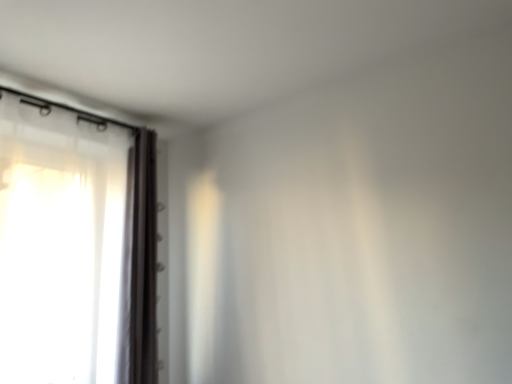
Measure the distance between white sheer curtain at left, the 2th curtain when ordered from right to left, and camera.

The distance of white sheer curtain at left, the 2th curtain when ordered from right to left, from camera is 5.32 feet.

The height and width of the screenshot is (384, 512). What do you see at coordinates (64, 245) in the screenshot?
I see `white sheer curtain at left, the 2th curtain when ordered from right to left` at bounding box center [64, 245].

You are a GUI agent. You are given a task and a screenshot of the screen. Output one action in this format:
    pyautogui.click(x=<x>, y=<y>)
    Task: Click on the white sheer curtain at left, the 2th curtain when ordered from right to left
    Image resolution: width=512 pixels, height=384 pixels.
    Given the screenshot: What is the action you would take?
    coord(64,245)

Measure the distance between point (112, 340) and camera.

The distance of point (112, 340) from camera is 6.18 feet.

How much space does white sheer curtain at left, marked as the second curtain in a left-to-right arrangement, occupy horizontally?

white sheer curtain at left, marked as the second curtain in a left-to-right arrangement, is 14.23 centimeters wide.

Describe the element at coordinates (140, 265) in the screenshot. This screenshot has width=512, height=384. I see `white sheer curtain at left, the first curtain in the right-to-left sequence` at that location.

Locate an element on the screen. This screenshot has height=384, width=512. white sheer curtain at left, marked as the second curtain in a left-to-right arrangement is located at coordinates (140, 265).

Image resolution: width=512 pixels, height=384 pixels. Find the location of `white sheer curtain at left, the 2th curtain when ordered from right to left`. white sheer curtain at left, the 2th curtain when ordered from right to left is located at coordinates (64, 245).

Consider the image. Based on their positions, is white sheer curtain at left, the first curtain viewed from the left, located to the left or right of white sheer curtain at left, the first curtain in the right-to-left sequence?

Clearly, white sheer curtain at left, the first curtain viewed from the left, is on the left of white sheer curtain at left, the first curtain in the right-to-left sequence, in the image.

In the image, is white sheer curtain at left, the 2th curtain when ordered from right to left, positioned in front of or behind white sheer curtain at left, the first curtain in the right-to-left sequence?

white sheer curtain at left, the 2th curtain when ordered from right to left, is positioned closer to the viewer than white sheer curtain at left, the first curtain in the right-to-left sequence.

Is point (19, 305) farther from viewer compared to point (146, 319)?

No, it is not.

From the image's perspective, is white sheer curtain at left, the first curtain viewed from the left, located above or below white sheer curtain at left, marked as the second curtain in a left-to-right arrangement?

Clearly, from the image's perspective, white sheer curtain at left, the first curtain viewed from the left, is above white sheer curtain at left, marked as the second curtain in a left-to-right arrangement.

From a real-world perspective, is white sheer curtain at left, the 2th curtain when ordered from right to left, located higher than white sheer curtain at left, marked as the second curtain in a left-to-right arrangement?

Yes.

Does white sheer curtain at left, the 2th curtain when ordered from right to left, have a greater width compared to white sheer curtain at left, marked as the second curtain in a left-to-right arrangement?

Yes.

Which of these two, white sheer curtain at left, the 2th curtain when ordered from right to left, or white sheer curtain at left, the first curtain in the right-to-left sequence, stands shorter?

white sheer curtain at left, the first curtain in the right-to-left sequence.

Who is smaller, white sheer curtain at left, the 2th curtain when ordered from right to left, or white sheer curtain at left, the first curtain in the right-to-left sequence?

white sheer curtain at left, the first curtain in the right-to-left sequence.

Do you think white sheer curtain at left, the 2th curtain when ordered from right to left, is within white sheer curtain at left, marked as the second curtain in a left-to-right arrangement, or outside of it?

The correct answer is: outside.

Is white sheer curtain at left, the first curtain viewed from the left, positioned far away from white sheer curtain at left, the first curtain in the right-to-left sequence?

They are positioned close to each other.

Is white sheer curtain at left, the 2th curtain when ordered from right to left, facing away from white sheer curtain at left, the first curtain in the right-to-left sequence?

No, white sheer curtain at left, the 2th curtain when ordered from right to left, is not facing the opposite direction of white sheer curtain at left, the first curtain in the right-to-left sequence.

How many degrees apart are the facing directions of white sheer curtain at left, the first curtain viewed from the left, and white sheer curtain at left, marked as the second curtain in a left-to-right arrangement?

There is a 2.17-degree angle between the facing directions of white sheer curtain at left, the first curtain viewed from the left, and white sheer curtain at left, marked as the second curtain in a left-to-right arrangement.

Could you measure the distance between white sheer curtain at left, the first curtain viewed from the left, and white sheer curtain at left, marked as the second curtain in a left-to-right arrangement?

white sheer curtain at left, the first curtain viewed from the left, and white sheer curtain at left, marked as the second curtain in a left-to-right arrangement, are 8.05 inches apart from each other.

This screenshot has width=512, height=384. I want to click on curtain above the white sheer curtain at left, the first curtain in the right-to-left sequence (from the image's perspective), so click(64, 245).

Can you confirm if white sheer curtain at left, marked as the second curtain in a left-to-right arrangement, is positioned to the left of white sheer curtain at left, the 2th curtain when ordered from right to left?

No, white sheer curtain at left, marked as the second curtain in a left-to-right arrangement, is not to the left of white sheer curtain at left, the 2th curtain when ordered from right to left.

Considering the relative positions of white sheer curtain at left, the first curtain in the right-to-left sequence, and white sheer curtain at left, the 2th curtain when ordered from right to left, in the image provided, is white sheer curtain at left, the first curtain in the right-to-left sequence, behind white sheer curtain at left, the 2th curtain when ordered from right to left,?

Yes, it is.

Between point (151, 178) and point (53, 382), which one is positioned in front?

Point (53, 382)

From the image's perspective, is white sheer curtain at left, the first curtain in the right-to-left sequence, above or below white sheer curtain at left, the 2th curtain when ordered from right to left?

white sheer curtain at left, the first curtain in the right-to-left sequence, is below white sheer curtain at left, the 2th curtain when ordered from right to left.

From a real-world perspective, is white sheer curtain at left, marked as the second curtain in a left-to-right arrangement, positioned under white sheer curtain at left, the 2th curtain when ordered from right to left, based on gravity?

Yes, from a real-world perspective, white sheer curtain at left, marked as the second curtain in a left-to-right arrangement, is beneath white sheer curtain at left, the 2th curtain when ordered from right to left.

Can you confirm if white sheer curtain at left, marked as the second curtain in a left-to-right arrangement, is wider than white sheer curtain at left, the first curtain viewed from the left?

No.

Between white sheer curtain at left, the first curtain in the right-to-left sequence, and white sheer curtain at left, the first curtain viewed from the left, which one has more height?

white sheer curtain at left, the first curtain viewed from the left, is taller.

Considering the sizes of objects white sheer curtain at left, marked as the second curtain in a left-to-right arrangement, and white sheer curtain at left, the 2th curtain when ordered from right to left, in the image provided, who is smaller, white sheer curtain at left, marked as the second curtain in a left-to-right arrangement, or white sheer curtain at left, the 2th curtain when ordered from right to left,?

With smaller size is white sheer curtain at left, marked as the second curtain in a left-to-right arrangement.

Consider the image. Is white sheer curtain at left, the 2th curtain when ordered from right to left, surrounded by white sheer curtain at left, marked as the second curtain in a left-to-right arrangement?

No, white sheer curtain at left, the 2th curtain when ordered from right to left, is not surrounded by white sheer curtain at left, marked as the second curtain in a left-to-right arrangement.

Are white sheer curtain at left, marked as the second curtain in a left-to-right arrangement, and white sheer curtain at left, the 2th curtain when ordered from right to left, located far from each other?

No.

Is white sheer curtain at left, marked as the second curtain in a left-to-right arrangement, aimed at white sheer curtain at left, the 2th curtain when ordered from right to left?

No, white sheer curtain at left, marked as the second curtain in a left-to-right arrangement, is not turned towards white sheer curtain at left, the 2th curtain when ordered from right to left.

How far apart are white sheer curtain at left, the first curtain in the right-to-left sequence, and white sheer curtain at left, the first curtain viewed from the left?

A distance of 8.05 inches exists between white sheer curtain at left, the first curtain in the right-to-left sequence, and white sheer curtain at left, the first curtain viewed from the left.

The image size is (512, 384). I want to click on curtain that is above the white sheer curtain at left, the first curtain in the right-to-left sequence (from a real-world perspective), so click(64, 245).

Where is `curtain in front of the white sheer curtain at left, the first curtain in the right-to-left sequence`? This screenshot has width=512, height=384. curtain in front of the white sheer curtain at left, the first curtain in the right-to-left sequence is located at coordinates (64, 245).

Find the location of a particular element. The width and height of the screenshot is (512, 384). curtain that is behind the white sheer curtain at left, the first curtain viewed from the left is located at coordinates (140, 265).